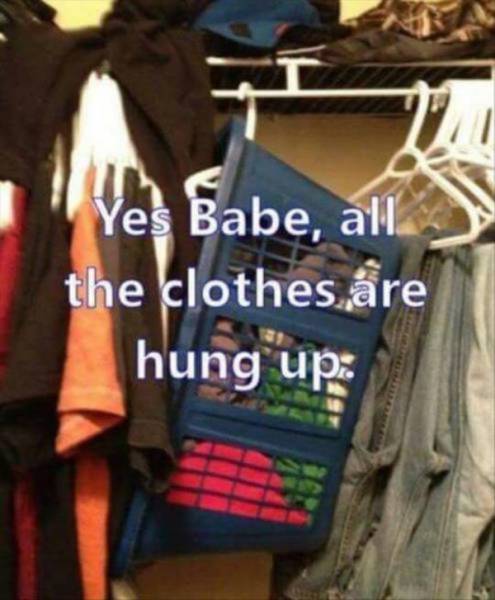
I want to click on shelf, so click(286, 61), click(411, 64).